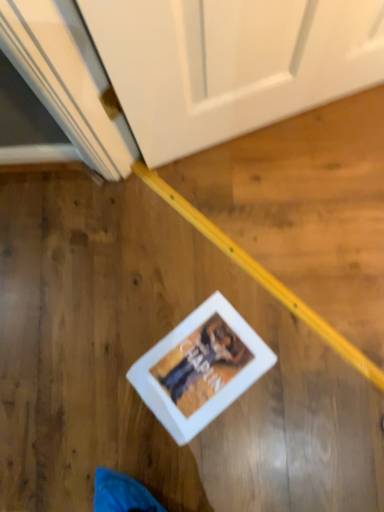
Where is `vacant area on top of white matte picture frame at lower center (from a real-world perspective)`? This screenshot has width=384, height=512. vacant area on top of white matte picture frame at lower center (from a real-world perspective) is located at coordinates (198, 371).